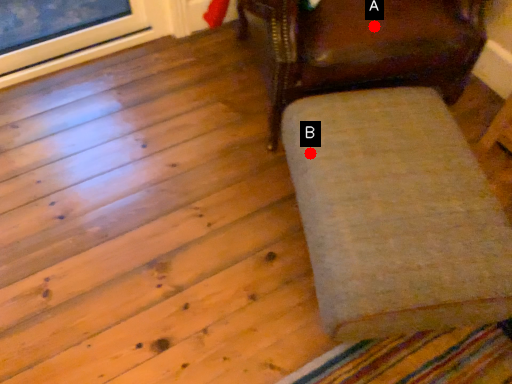
Question: Two points are circled on the image, labeled by A and B beside each circle. Which point is further to the camera?

Choices:
 (A) A is further
 (B) B is further

Answer: (A)